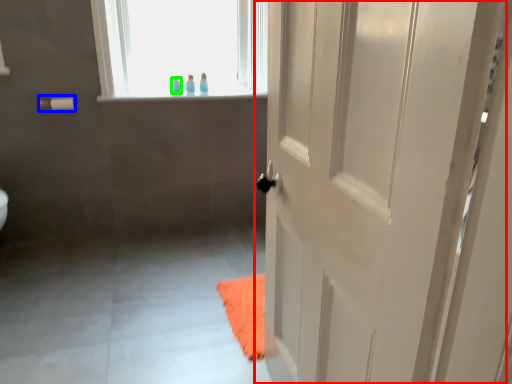
Question: Estimate the real-world distances between objects in this image. Which object is farther from door (highlighted by a red box), towel bar (highlighted by a blue box) or toiletry (highlighted by a green box)?

Choices:
 (A) towel bar
 (B) toiletry

Answer: (A)